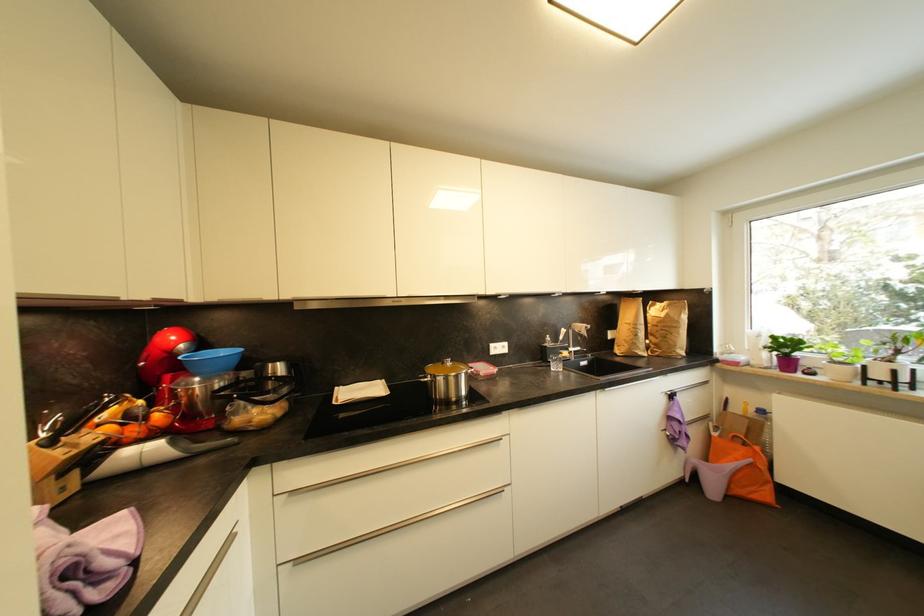
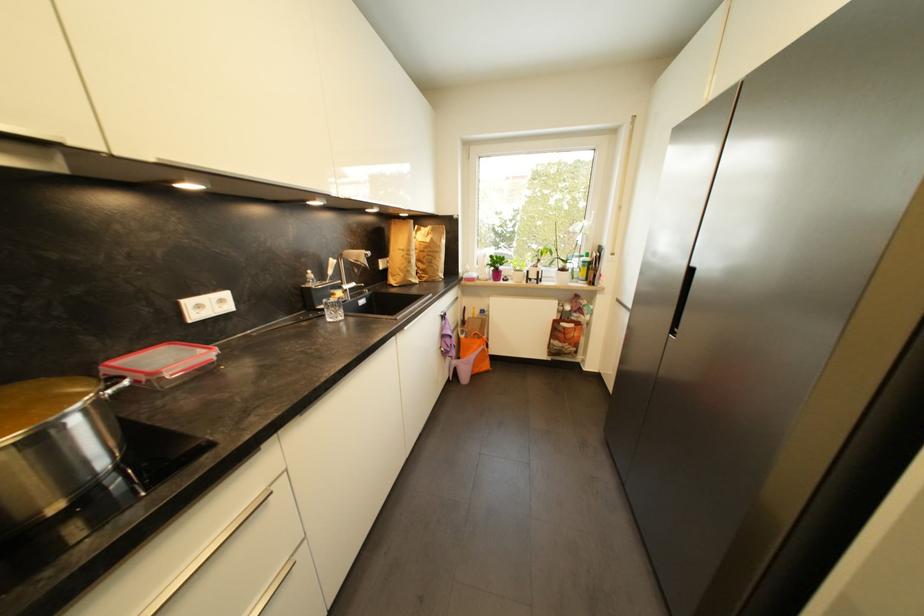
Question: I am providing you with two images of the same scene from different viewpoints. Please identify which objects are invisible in image2.

Choices:
 (A) faucet handle
 (B) orange shopping bag
 (C) silver drawer handle
 (D) none of these

Answer: (D)